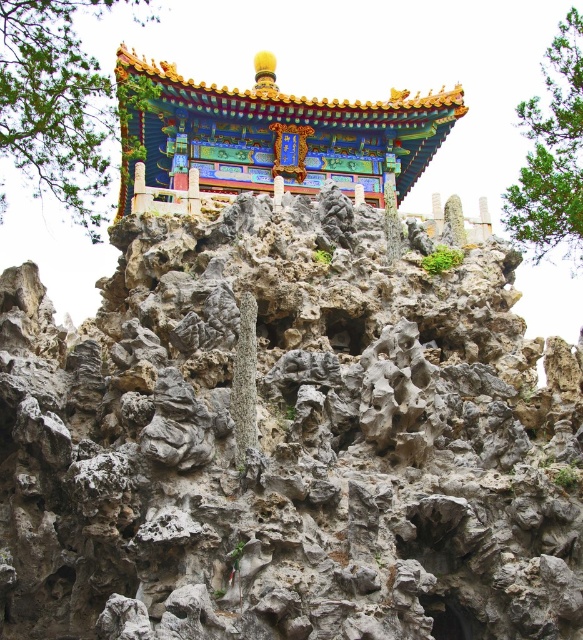
You are an architect designing a new structure that needs to be wider than the gray rough rock face at center. Can the shiny lacquered pavilion at center provide enough space for your design?

The shiny lacquered pavilion at center is wider than the gray rough rock face at center, so yes, it can provide enough space for your design.

You are an architect designing a new garden layout. You want to place a statue exactly halfway between the shiny lacquered pavilion at center and the green leafy tree at upper right. Which object will the statue be closer to?

The statue will be closer to the shiny lacquered pavilion at center because it is shorter than the green leafy tree at upper right, so the halfway point would be nearer to the pavilion.